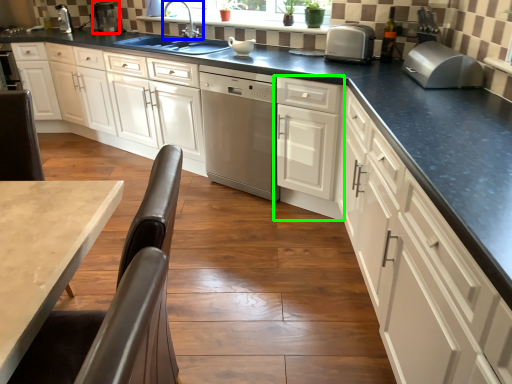
Question: Estimate the real-world distances between objects in this image. Which object is farther from appliance (highlighted by a red box), tap (highlighted by a blue box) or cabinetry (highlighted by a green box)?

Choices:
 (A) tap
 (B) cabinetry

Answer: (B)